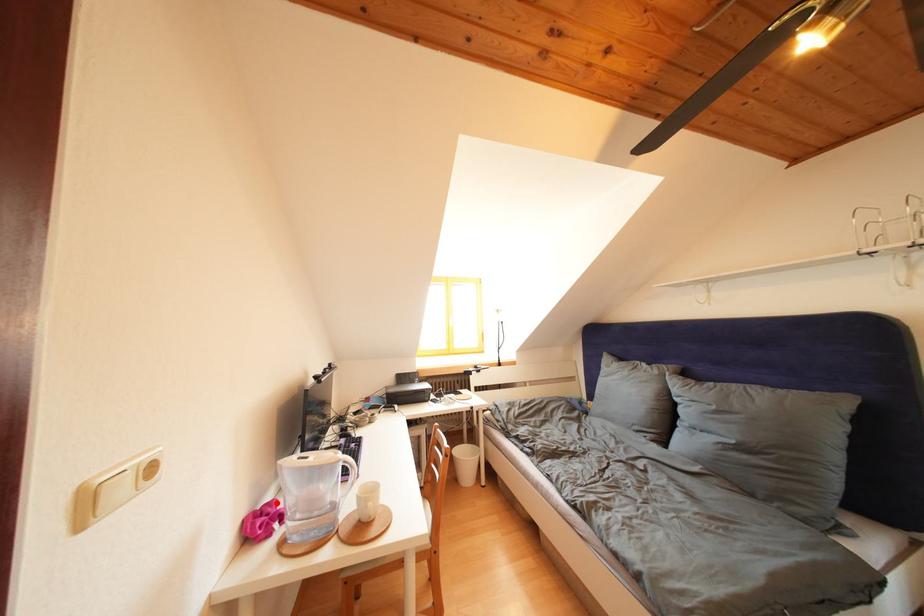
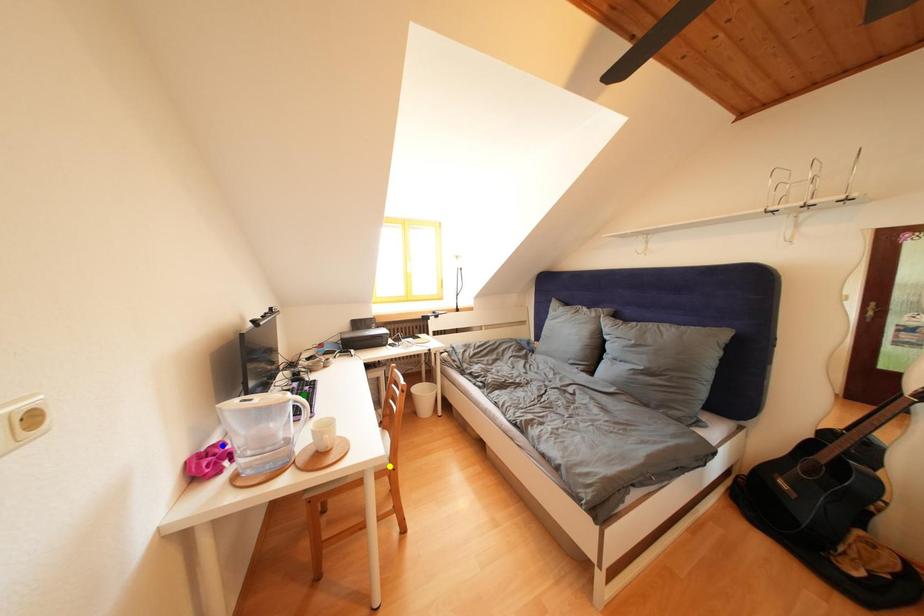
Question: I am providing you with two images of the same scene from different viewpoints. A red point is marked on the first image. You are given multiple points on the second image. Can you choose the point in image 2 that corresponds to the point in image 1?

Choices:
 (A) yellow point
 (B) blue point
 (C) green point

Answer: (B)